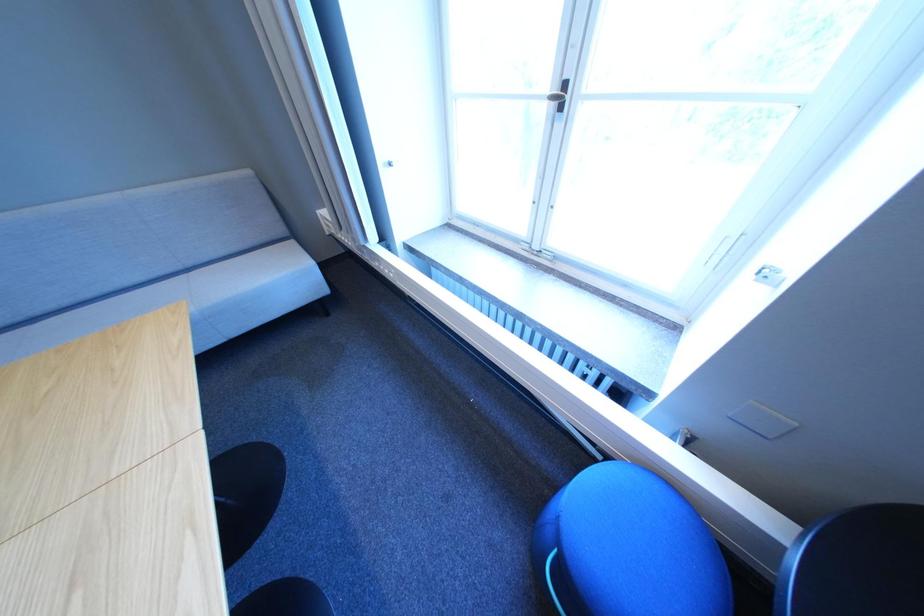
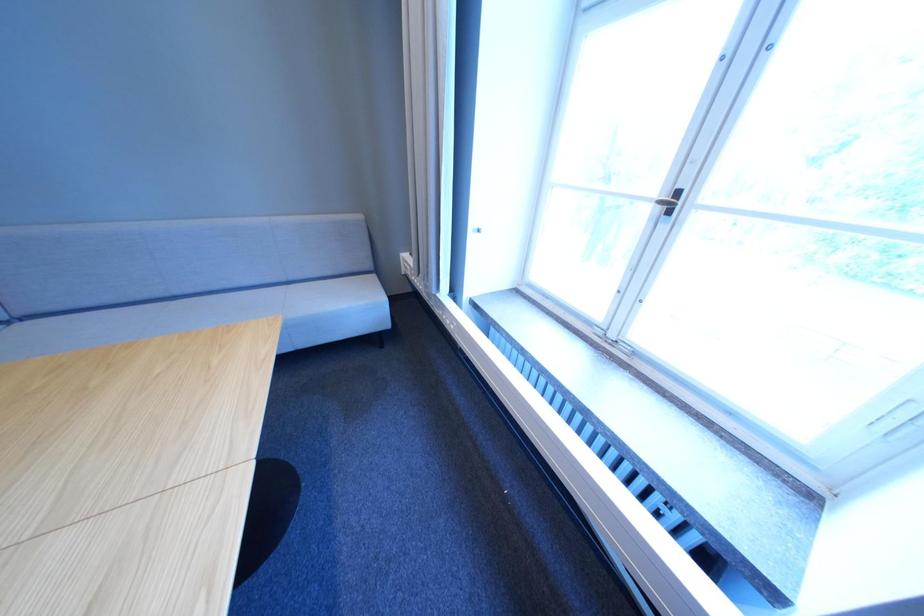
Question: Based on the continuous images, in which direction is the camera rotating? Reply with the corresponding letter.

Choices:
 (A) Left
 (B) Right
 (C) Up
 (D) Down

Answer: (A)